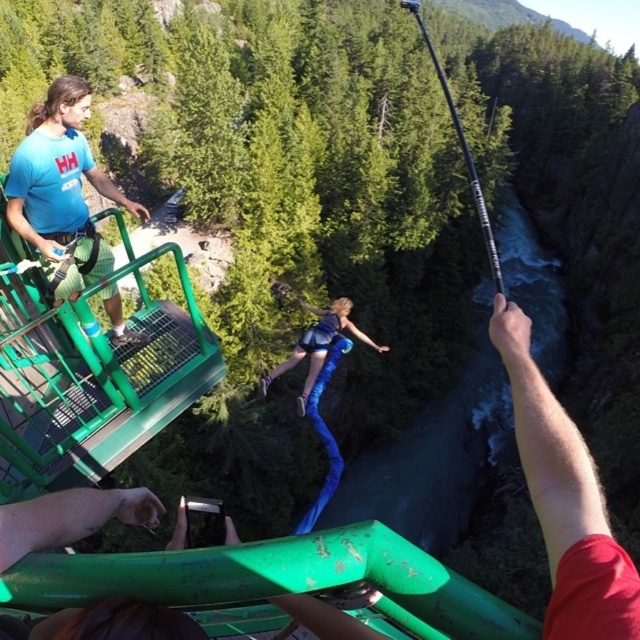
In the scene shown: How much distance is there between blue t-shirt at left and blue fabric at center?

blue t-shirt at left is 8.20 meters from blue fabric at center.

Who is more forward, (74,90) or (330,339)?

Point (74,90) is in front.

Does point (67, 74) lie in front of point (324, 314)?

No.

The image size is (640, 640). Identify the location of blue t-shirt at left. (61, 189).